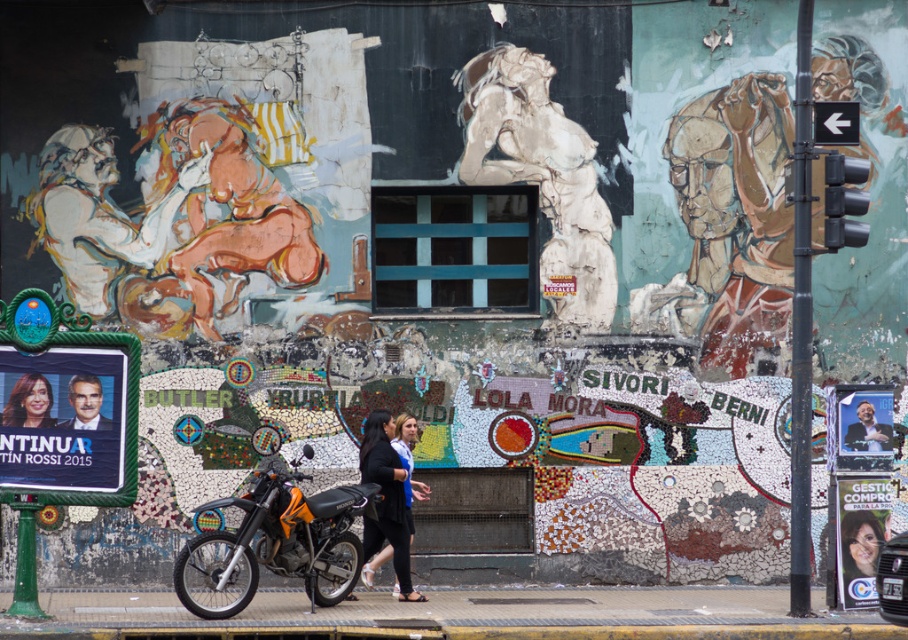
Between smooth skin face at center and smooth skin portrait at center, which one is positioned higher?

smooth skin portrait at center is higher up.

Can you confirm if smooth skin face at center is bigger than smooth skin portrait at center?

No, smooth skin face at center is not bigger than smooth skin portrait at center.

Where is `smooth skin face at center`? This screenshot has height=640, width=908. smooth skin face at center is located at coordinates (28, 403).

Is orange matte motorcycle at center positioned in front of smooth skin portrait at center?

Yes, orange matte motorcycle at center is closer to the viewer.

Is orange matte motorcycle at center bigger than smooth skin portrait at center?

Yes, orange matte motorcycle at center is bigger than smooth skin portrait at center.

The height and width of the screenshot is (640, 908). What do you see at coordinates (273, 541) in the screenshot?
I see `orange matte motorcycle at center` at bounding box center [273, 541].

Where is `orange matte motorcycle at center`? orange matte motorcycle at center is located at coordinates (273, 541).

Between black leather jacket at center and smooth skin portrait at center, which one is positioned lower?

black leather jacket at center

Between black leather jacket at center and smooth skin portrait at center, which one is positioned higher?

Positioned higher is smooth skin portrait at center.

Between point (376, 531) and point (73, 388), which one is positioned in front?

Point (73, 388) is in front.

Find the location of `black leather jacket at center`. black leather jacket at center is located at coordinates (386, 499).